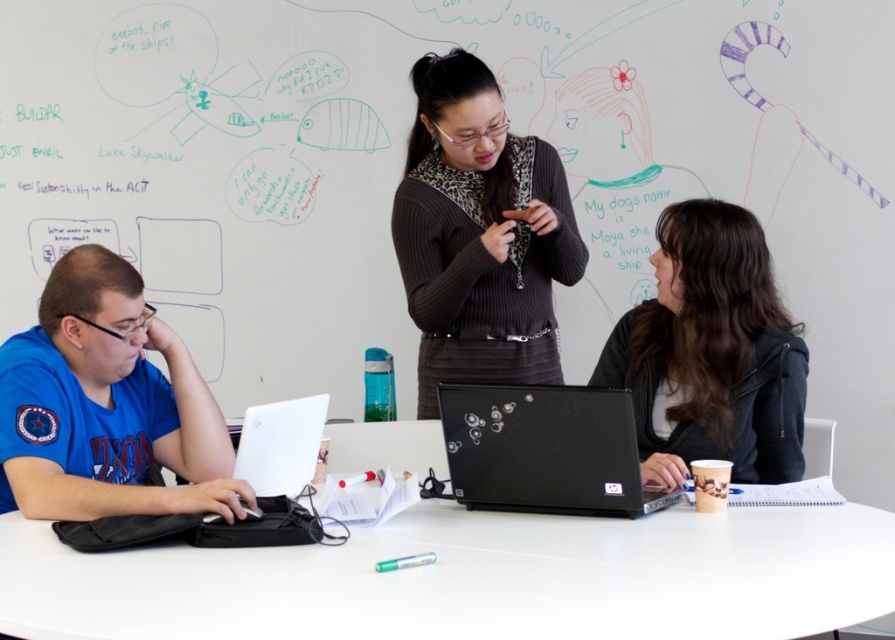
Does black glossy laptop at center have a lesser height compared to white glossy laptop at lower left?

No.

Can you confirm if black glossy laptop at center is positioned above white glossy laptop at lower left?

Incorrect, black glossy laptop at center is not positioned above white glossy laptop at lower left.

Measure the distance between black glossy laptop at center and camera.

A distance of 1.65 meters exists between black glossy laptop at center and camera.

Locate an element on the screen. black glossy laptop at center is located at coordinates (544, 449).

Who is more forward, (530, 348) or (304, 397)?

Point (304, 397)

Who is higher up, matte black sweater at center or white glossy laptop at lower left?

matte black sweater at center is above.

Is point (457, 326) farther from viewer compared to point (314, 416)?

Yes.

You are a GUI agent. You are given a task and a screenshot of the screen. Output one action in this format:
    pyautogui.click(x=<x>, y=<y>)
    Task: Click on the matte black sweater at center
    
    Given the screenshot: What is the action you would take?
    pyautogui.click(x=479, y=234)

Does matte black sweater at center have a greater height compared to black matte jacket at center?

Yes, matte black sweater at center is taller than black matte jacket at center.

Between point (422, 369) and point (638, 419), which one is positioned in front?

Point (638, 419) is more forward.

The height and width of the screenshot is (640, 895). I want to click on matte black sweater at center, so click(x=479, y=234).